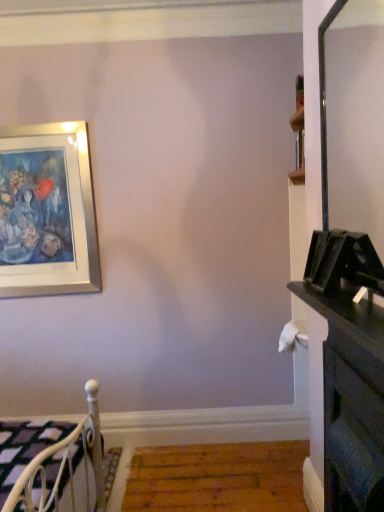
Question: Does white metal bed at lower left come in front of black glossy dresser at lower right?

Choices:
 (A) yes
 (B) no

Answer: (B)

Question: Is white metal bed at lower left outside of black glossy dresser at lower right?

Choices:
 (A) yes
 (B) no

Answer: (A)

Question: Is there a large distance between white metal bed at lower left and black glossy dresser at lower right?

Choices:
 (A) no
 (B) yes

Answer: (A)

Question: From a real-world perspective, is white metal bed at lower left physically below black glossy dresser at lower right?

Choices:
 (A) yes
 (B) no

Answer: (A)

Question: Is white metal bed at lower left bigger than black glossy dresser at lower right?

Choices:
 (A) no
 (B) yes

Answer: (B)

Question: Can you see white metal bed at lower left touching black glossy dresser at lower right?

Choices:
 (A) yes
 (B) no

Answer: (B)

Question: Could you tell me if black glossy dresser at lower right is turned towards white metal bed at lower left?

Choices:
 (A) no
 (B) yes

Answer: (B)

Question: Is black glossy dresser at lower right positioned beyond the bounds of white metal bed at lower left?

Choices:
 (A) no
 (B) yes

Answer: (B)

Question: Is black glossy dresser at lower right bigger than white metal bed at lower left?

Choices:
 (A) yes
 (B) no

Answer: (B)

Question: Can you confirm if black glossy dresser at lower right is positioned to the left of white metal bed at lower left?

Choices:
 (A) no
 (B) yes

Answer: (A)

Question: Does black glossy dresser at lower right have a greater height compared to white metal bed at lower left?

Choices:
 (A) yes
 (B) no

Answer: (A)

Question: Does black glossy dresser at lower right have a smaller size compared to white metal bed at lower left?

Choices:
 (A) yes
 (B) no

Answer: (A)

Question: Is black glossy dresser at lower right in front of or behind white metal bed at lower left in the image?

Choices:
 (A) front
 (B) behind

Answer: (A)